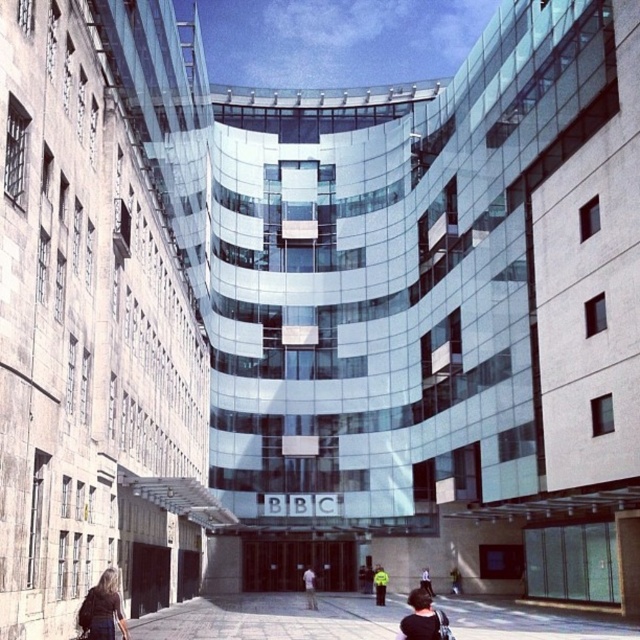
Question: Is black fabric hair at lower center above light blue shirt at center?

Choices:
 (A) no
 (B) yes

Answer: (B)

Question: Which object appears farthest from the camera in this image?

Choices:
 (A) dark blue jeans at lower center
 (B) black fabric hair at lower center
 (C) dark brown leather jacket at lower left
 (D) yellow reflective jacket at center

Answer: (A)

Question: Does dark brown leather jacket at lower left appear on the left side of light blue shirt at center?

Choices:
 (A) no
 (B) yes

Answer: (B)

Question: Which point is farther to the camera?

Choices:
 (A) (308, 589)
 (B) (342, 627)
 (C) (428, 588)
 (D) (381, 570)

Answer: (D)

Question: In this image, where is light blue shirt at center located relative to dark blue jeans at lower center?

Choices:
 (A) left
 (B) right

Answer: (A)

Question: Which point appears farthest from the camera in this image?

Choices:
 (A) (308, 570)
 (B) (563, 621)
 (C) (420, 584)
 (D) (100, 593)

Answer: (A)